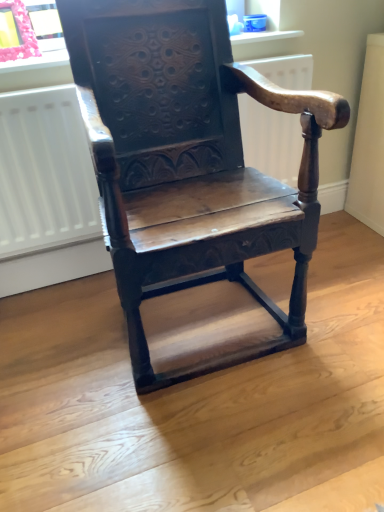
Question: Is pink fabric at upper left inside or outside of matte plastic window sill at upper center?

Choices:
 (A) outside
 (B) inside

Answer: (A)

Question: From a real-world perspective, is pink fabric at upper left above or below matte plastic window sill at upper center?

Choices:
 (A) below
 (B) above

Answer: (B)

Question: Which object is positioned farthest from the wooden carved chair at center?

Choices:
 (A) white matte radiator at center
 (B) pink fabric at upper left
 (C) matte plastic window sill at upper center

Answer: (B)

Question: Based on their relative distances, which object is nearer to the pink fabric at upper left?

Choices:
 (A) wooden carved chair at center
 (B) white matte radiator at center
 (C) matte plastic window sill at upper center

Answer: (C)